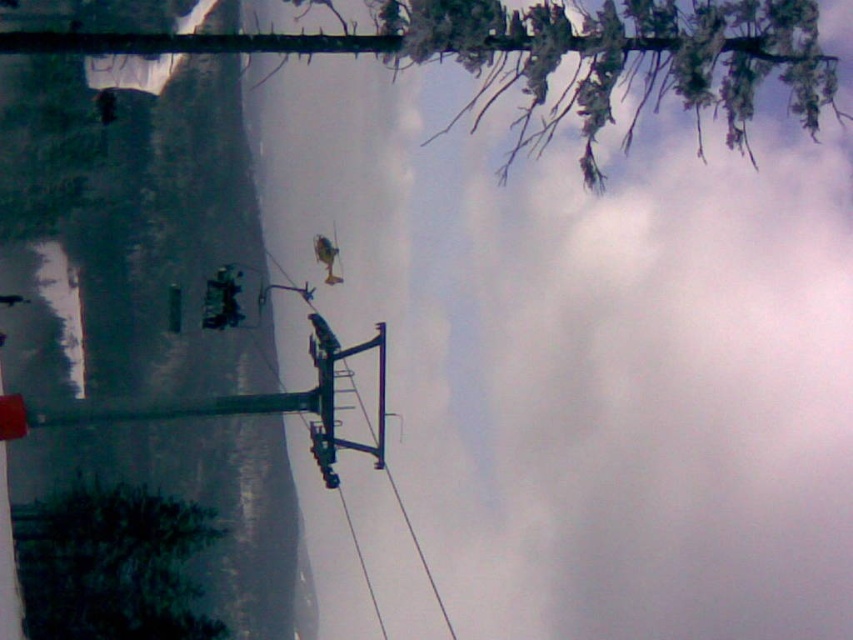
You are standing at the base of the ski lift and want to reach a specific point marked at coordinates point (136, 269). If you can walk 50 meters in 1 minute, how long will it take you to reach that point?

The point (136, 269) is 40.56 meters away from the viewer. Since you can walk 50 meters in 1 minute, it will take you approximately 48.67 seconds to reach the point.

You are a winter photographer standing at the base of the ski lift and want to capture a photo of the smooth snow at left and the green matte tree at lower left. Which object should you focus on first to ensure it appears sharp in the foreground?

The smooth snow at left is in front of the green matte tree at lower left, so you should focus on the smooth snow at left first to ensure it appears sharp in the foreground.

You are standing at the center of the image and want to walk to the smooth snow at left. Which direction should you face to walk directly towards it?

You should face towards the left direction to walk directly towards the smooth snow at left.